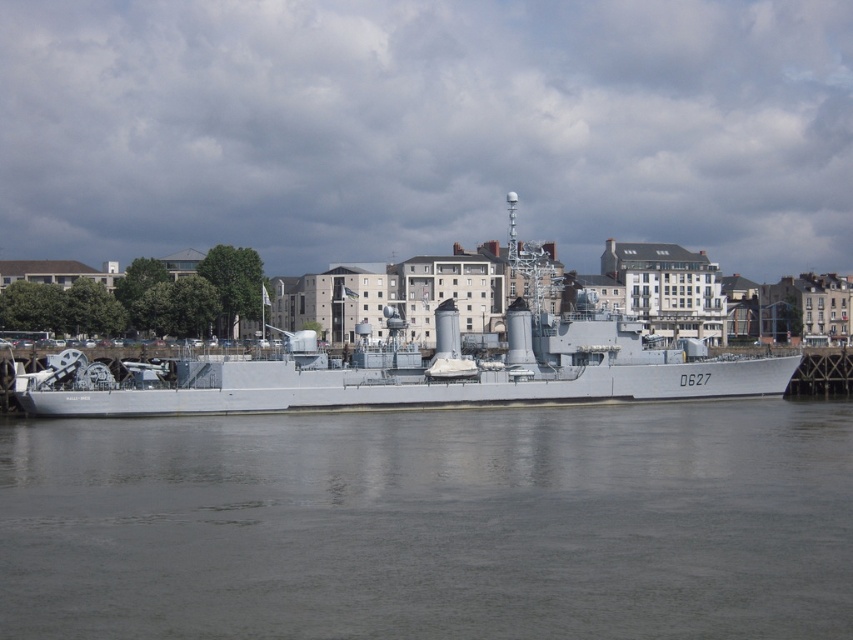
Question: Among these objects, which one is farthest from the camera?

Choices:
 (A) gray smooth water at center
 (B) white metallic ship at center

Answer: (B)

Question: From the image, what is the correct spatial relationship of gray smooth water at center in relation to white metallic ship at center?

Choices:
 (A) left
 (B) right

Answer: (B)

Question: Which point is farther to the camera?

Choices:
 (A) (409, 376)
 (B) (564, 620)

Answer: (A)

Question: Can you confirm if gray smooth water at center is bigger than white metallic ship at center?

Choices:
 (A) no
 (B) yes

Answer: (A)

Question: Does gray smooth water at center appear on the left side of white metallic ship at center?

Choices:
 (A) no
 (B) yes

Answer: (A)